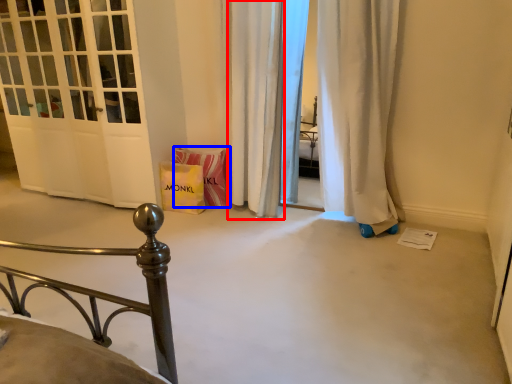
Question: Among these objects, which one is farthest to the camera, curtain (highlighted by a red box) or material (highlighted by a blue box)?

Choices:
 (A) curtain
 (B) material

Answer: (B)